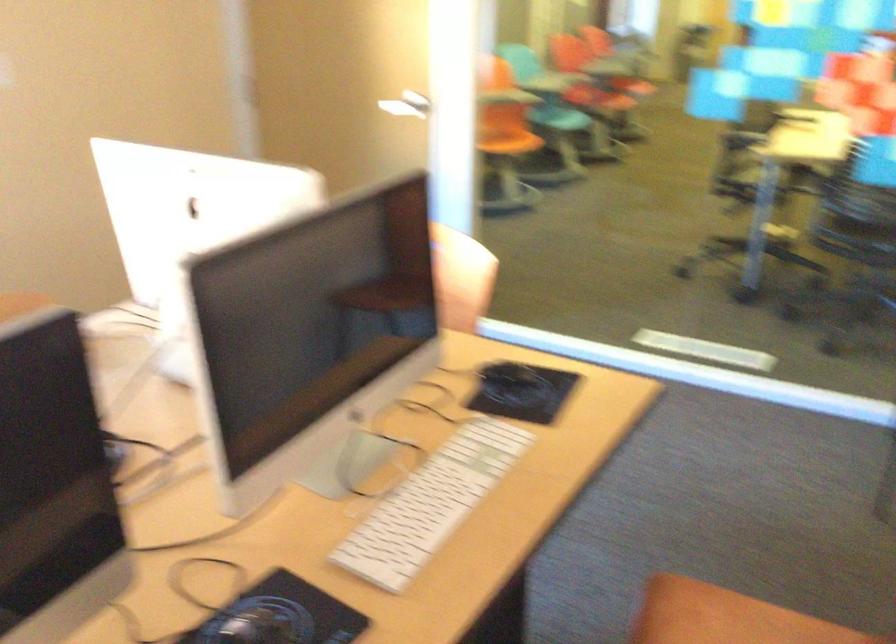
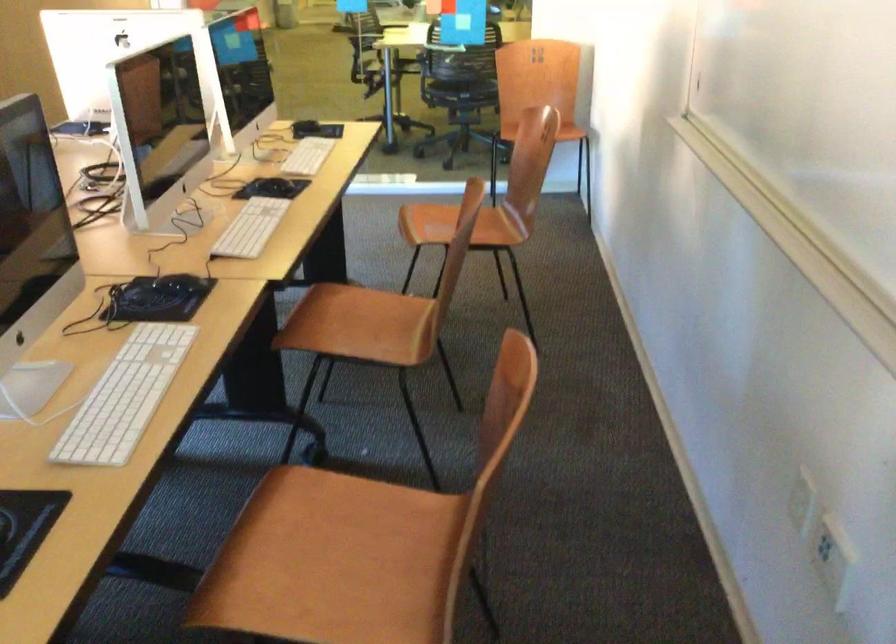
The images are taken continuously from a first-person perspective. In which direction are you moving?

The cameraman walked toward left, backward.